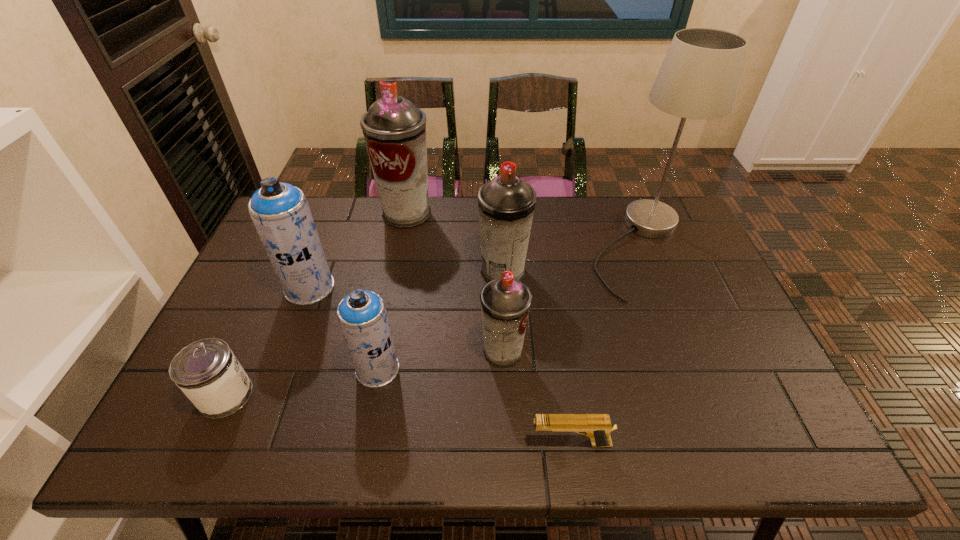
Image resolution: width=960 pixels, height=540 pixels. Find the location of `free space located 0.330m at the barrel of the pistol`. free space located 0.330m at the barrel of the pistol is located at coordinates (376, 443).

The width and height of the screenshot is (960, 540). What are the coordinates of `free region located 0.180m at the barrel of the pistol` in the screenshot? It's located at (446, 443).

Locate an element on the screen. The width and height of the screenshot is (960, 540). free space located at the barrel of the pistol is located at coordinates (419, 443).

The width and height of the screenshot is (960, 540). Find the location of `table lamp that is at the far edge`. table lamp that is at the far edge is located at coordinates (698, 79).

You are a GUI agent. You are given a task and a screenshot of the screen. Output one action in this format:
    pyautogui.click(x=<x>, y=<y>)
    Task: Click on the aerosol can at the far edge
    This screenshot has height=540, width=960.
    Given the screenshot: What is the action you would take?
    pyautogui.click(x=394, y=129)

Where is `can present at the near edge`? can present at the near edge is located at coordinates (206, 371).

The image size is (960, 540). I want to click on pistol at the near edge, so click(597, 427).

You are a GUI agent. You are given a task and a screenshot of the screen. Output one action in this format:
    pyautogui.click(x=<x>, y=<y>)
    Task: Click on the aerosol can present at the left edge
    This screenshot has width=960, height=540.
    Given the screenshot: What is the action you would take?
    pyautogui.click(x=280, y=212)

I want to click on can that is at the left edge, so click(x=206, y=371).

Locate an element on the screen. object that is at the right edge is located at coordinates (698, 79).